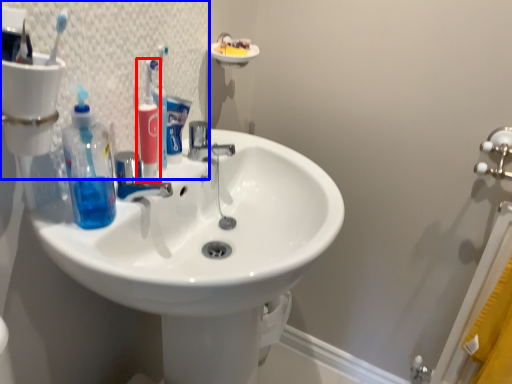
Question: Which of the following is the closest to the observer, toiletry (highlighted by a red box) or mirror (highlighted by a blue box)?

Choices:
 (A) toiletry
 (B) mirror

Answer: (B)